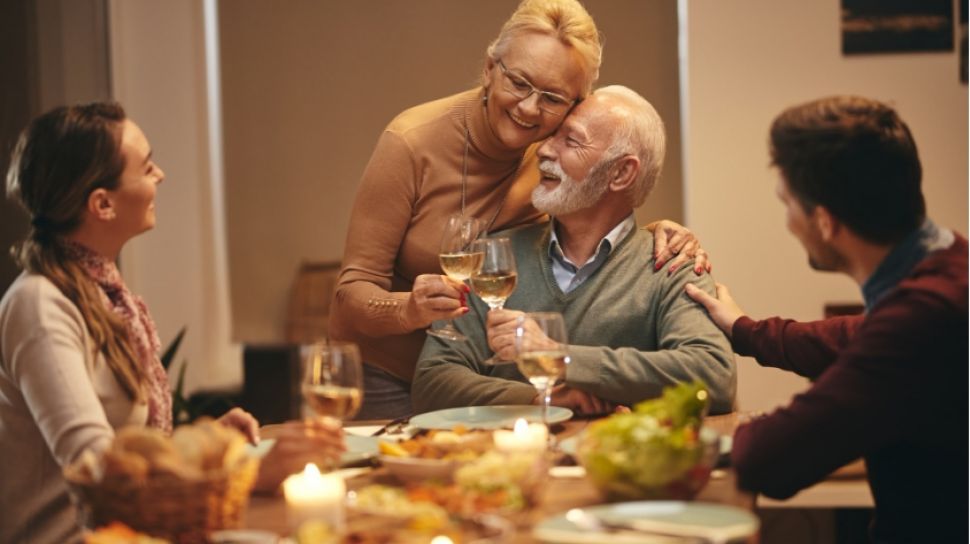
Locate an element on the screen. plates is located at coordinates (665, 517), (722, 446), (499, 415), (352, 431).